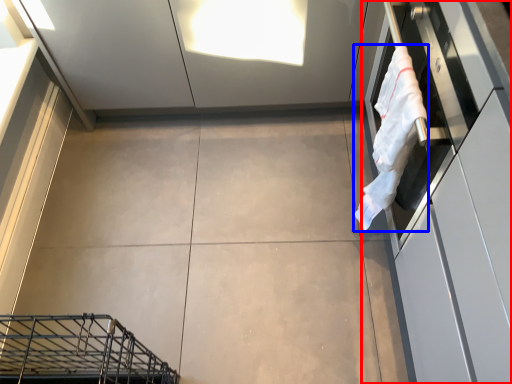
Question: Which object appears closest to the camera in this image, cabinetry (highlighted by a red box) or laundry (highlighted by a blue box)?

Choices:
 (A) cabinetry
 (B) laundry

Answer: (A)